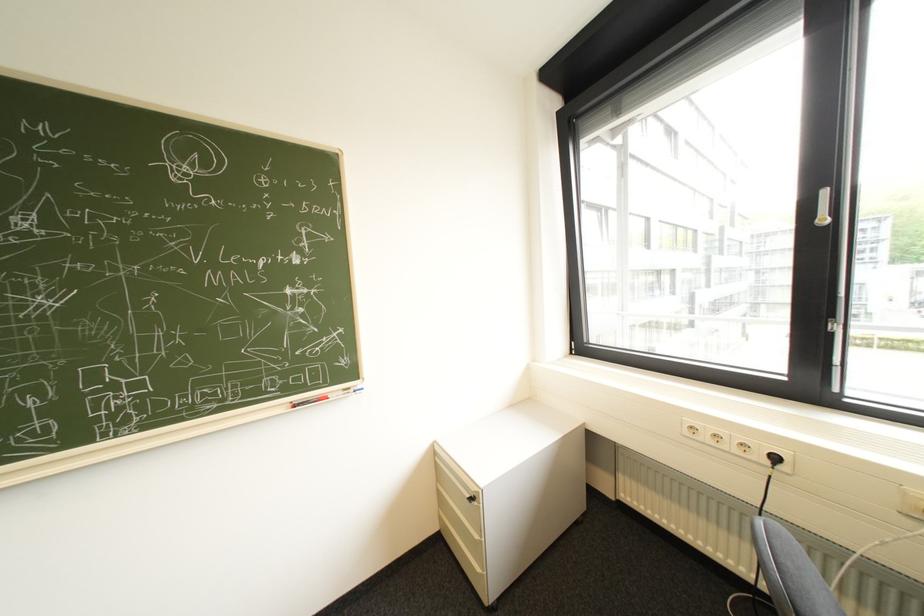
Where is `cabinet lock`? The width and height of the screenshot is (924, 616). cabinet lock is located at coordinates (470, 498).